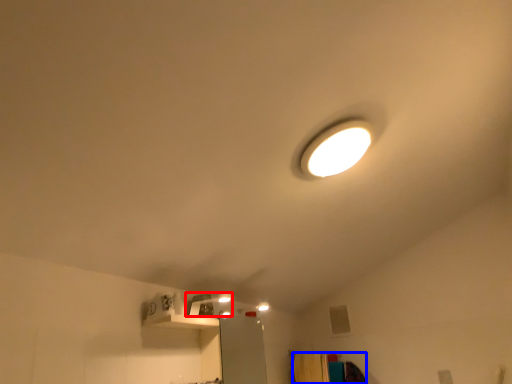
Question: Which object appears closest to the camera in this image, lamp (highlighted by a red box) or furniture (highlighted by a blue box)?

Choices:
 (A) lamp
 (B) furniture

Answer: (A)